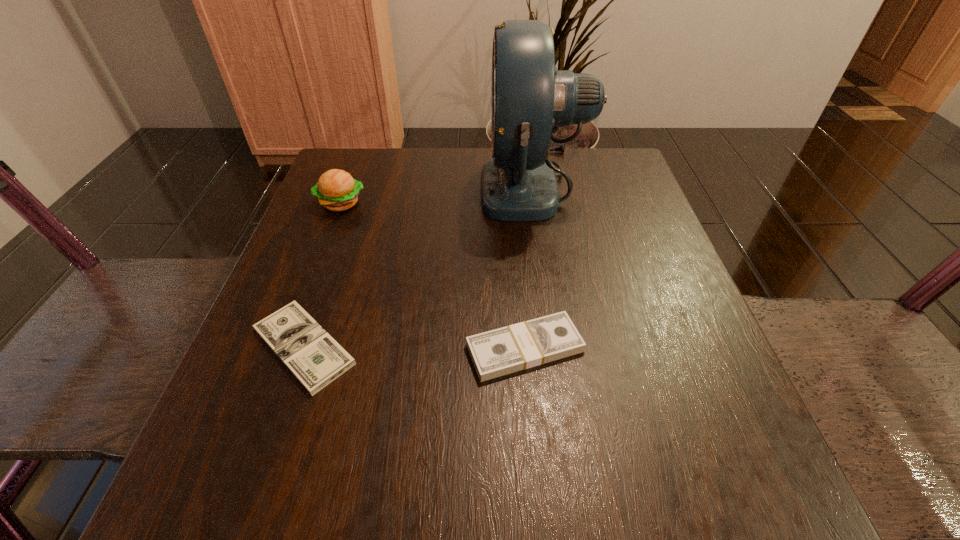
Image resolution: width=960 pixels, height=540 pixels. In order to click on fan in this screenshot , I will do `click(530, 98)`.

Where is `hamburger`? hamburger is located at coordinates (336, 190).

Locate an element on the screen. the right dollar is located at coordinates (495, 353).

Identify the location of the second shortest object. coord(495,353).

Where is `the shortest object`? This screenshot has height=540, width=960. the shortest object is located at coordinates (308, 351).

Where is `the left dollar`? This screenshot has width=960, height=540. the left dollar is located at coordinates (308, 351).

Where is `vacant space situated 0.110m in front of the fan to blow air`? This screenshot has width=960, height=540. vacant space situated 0.110m in front of the fan to blow air is located at coordinates (433, 187).

At what (x,y) coordinates should I click in order to perform the action: click on free point located 0.070m in front of the fan to blow air. Please return your answer as a coordinate pair (x, y). The image size is (960, 540). Looking at the image, I should click on (450, 187).

The height and width of the screenshot is (540, 960). What are the coordinates of `blank area located in front of the fan to blow air` in the screenshot? It's located at (324, 187).

Find the location of a particular element. The height and width of the screenshot is (540, 960). free space located 0.130m on the back of the hamburger is located at coordinates (357, 161).